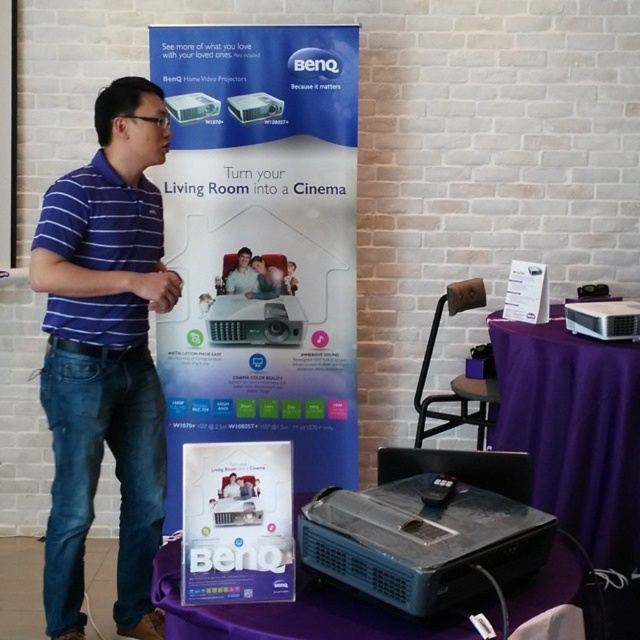
Question: Where is blue striped polo shirt at center located in relation to black plastic game controller at lower center in the image?

Choices:
 (A) below
 (B) above

Answer: (B)

Question: Which point is farther from the camera taking this photo?

Choices:
 (A) (339, 44)
 (B) (113, 180)
 (C) (451, 296)
 (D) (246, 252)

Answer: (D)

Question: Does wooden speaker at center come in front of black plastic game controller at lower center?

Choices:
 (A) no
 (B) yes

Answer: (A)

Question: Which is farther from the black plastic game controller at lower center?

Choices:
 (A) white glossy poster at center
 (B) blue striped polo shirt at left

Answer: (A)

Question: Among these points, which one is farthest from the camera?

Choices:
 (A) (424, 493)
 (B) (257, 291)

Answer: (B)

Question: Can you confirm if wooden speaker at center is positioned to the left of black plastic game controller at lower center?

Choices:
 (A) no
 (B) yes

Answer: (A)